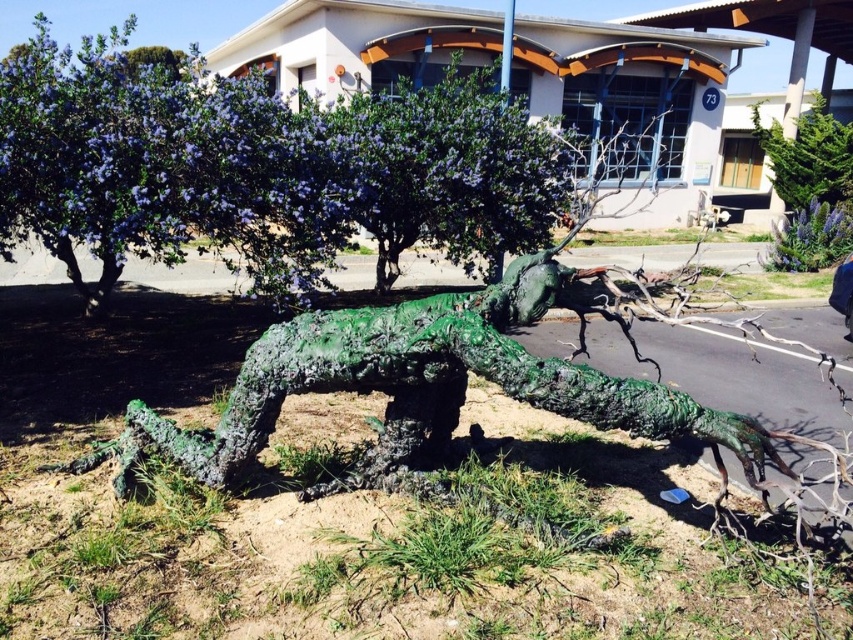
Question: Is green matte tree at upper center to the left of green textured sculpture at center from the viewer's perspective?

Choices:
 (A) no
 (B) yes

Answer: (A)

Question: Is green textured sculpture at center wider than green textured tree at upper right?

Choices:
 (A) no
 (B) yes

Answer: (B)

Question: Does green textured sculpture at center come in front of green textured tree at upper right?

Choices:
 (A) no
 (B) yes

Answer: (B)

Question: Which of these objects is positioned closest to the green textured tree at upper right?

Choices:
 (A) green matte tree at upper center
 (B) green textured sculpture at center

Answer: (A)

Question: Which object is positioned farthest from the green matte tree at upper center?

Choices:
 (A) green textured tree at upper right
 (B) green textured sculpture at center

Answer: (A)

Question: Considering the real-world distances, which object is closest to the green textured sculpture at center?

Choices:
 (A) green textured tree at upper right
 (B) green matte tree at upper center

Answer: (B)